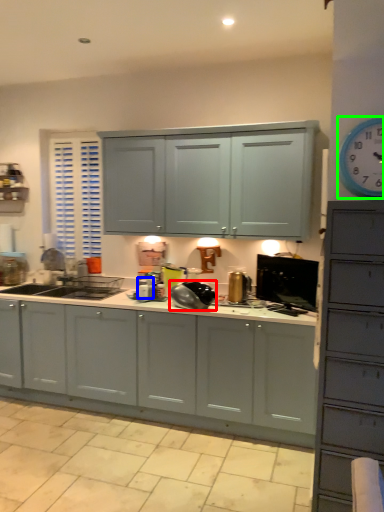
Question: Which object is the farthest from appliance (highlighted by a red box)? Choose among these: appliance (highlighted by a blue box) or clock (highlighted by a green box).

Choices:
 (A) appliance
 (B) clock

Answer: (B)